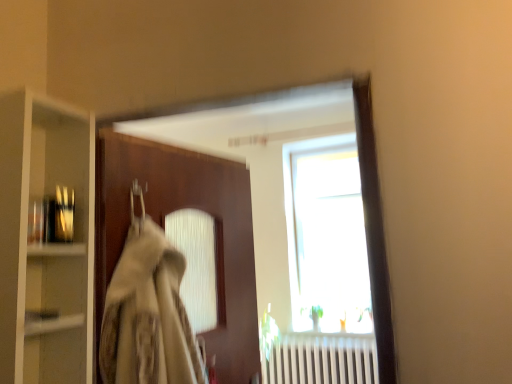
What do you see at coordinates (45, 241) in the screenshot? I see `clear glass cabinet at left` at bounding box center [45, 241].

In order to click on brown wooden door at center in this screenshot , I will do `click(164, 226)`.

Locate an element on the screen. The image size is (512, 384). clear glass cabinet at left is located at coordinates (45, 241).

Considering the sizes of objects brown wooden door at center and metallic glass bottles at left in the image provided, who is shorter, brown wooden door at center or metallic glass bottles at left?

Standing shorter between the two is metallic glass bottles at left.

Is brown wooden door at center far from metallic glass bottles at left?

No.

Is metallic glass bottles at left at the back of brown wooden door at center?

That's not correct — brown wooden door at center is not looking away from metallic glass bottles at left.

From the image's perspective, does brown wooden door at center appear higher than clear glass cabinet at left?

No.

Is brown wooden door at center thinner than clear glass cabinet at left?

Correct, the width of brown wooden door at center is less than that of clear glass cabinet at left.

Would you say brown wooden door at center is a long distance from clear glass cabinet at left?

No, brown wooden door at center is not far away from clear glass cabinet at left.

How many degrees apart are the facing directions of brown wooden door at center and clear glass cabinet at left?

There is a 24.8-degree angle between the facing directions of brown wooden door at center and clear glass cabinet at left.

From the image's perspective, which one is positioned lower, clear glass cabinet at left or brown wooden door at center?

brown wooden door at center is shown below in the image.

Are clear glass cabinet at left and brown wooden door at center making contact?

No, clear glass cabinet at left is not beside brown wooden door at center.

Considering the sizes of clear glass cabinet at left and brown wooden door at center in the image, is clear glass cabinet at left wider or thinner than brown wooden door at center?

Clearly, clear glass cabinet at left has more width compared to brown wooden door at center.

Is brown wooden door at center surrounded by clear glass cabinet at left?

Actually, brown wooden door at center is outside clear glass cabinet at left.

Based on the photo, from the image's perspective, is clear glass cabinet at left positioned above or below metallic glass bottles at left?

clear glass cabinet at left is situated lower than metallic glass bottles at left in the image.

Consider the image. What's the angular difference between clear glass cabinet at left and metallic glass bottles at left's facing directions?

7.95 degrees.

Can you confirm if clear glass cabinet at left is positioned to the right of metallic glass bottles at left?

No, clear glass cabinet at left is not to the right of metallic glass bottles at left.

The image size is (512, 384). Identify the location of shelf above the clear glass cabinet at left (from a real-world perspective). (54, 225).

Is metallic glass bottles at left spatially inside clear glass cabinet at left, or outside of it?

The correct answer is: inside.

Which is more to the left, metallic glass bottles at left or clear glass cabinet at left?

clear glass cabinet at left is more to the left.

Is point (57, 215) closer or farther from the camera than point (39, 221)?

Point (57, 215).

In the image, there is a clear glass cabinet at left. Find the location of `shelf above it (from the image's perspective)`. shelf above it (from the image's perspective) is located at coordinates (54, 225).

Is metallic glass bottles at left spatially inside brown wooden door at center, or outside of it?

The correct answer is: outside.

Who is more distant, metallic glass bottles at left or brown wooden door at center?

Positioned behind is brown wooden door at center.

Is metallic glass bottles at left placed right next to brown wooden door at center?

No, metallic glass bottles at left is not with brown wooden door at center.

From a real-world perspective, which is physically above, metallic glass bottles at left or brown wooden door at center?

From a 3D spatial view, metallic glass bottles at left is above.

This screenshot has width=512, height=384. What are the coordinates of `door behind the metallic glass bottles at left` in the screenshot? It's located at (164, 226).

You are a GUI agent. You are given a task and a screenshot of the screen. Output one action in this format:
    pyautogui.click(x=<x>, y=<y>)
    Task: Click on the cabinetry that is on the left side of brown wooden door at center
    The image size is (512, 384).
    Given the screenshot: What is the action you would take?
    pyautogui.click(x=45, y=241)

Estimate the real-world distances between objects in this image. Which object is further from clear glass cabinet at left, brown wooden door at center or metallic glass bottles at left?

brown wooden door at center is positioned further to the anchor clear glass cabinet at left.

Estimate the real-world distances between objects in this image. Which object is closer to brown wooden door at center, metallic glass bottles at left or clear glass cabinet at left?

clear glass cabinet at left lies closer to brown wooden door at center than the other object.

Looking at this image, based on their spatial positions, is clear glass cabinet at left or brown wooden door at center further from metallic glass bottles at left?

The object further to metallic glass bottles at left is brown wooden door at center.

Which object lies nearer to the anchor point brown wooden door at center, clear glass cabinet at left or metallic glass bottles at left?

clear glass cabinet at left is closer to brown wooden door at center.

Considering their positions, is metallic glass bottles at left positioned further to clear glass cabinet at left than brown wooden door at center?

brown wooden door at center is positioned further to the anchor clear glass cabinet at left.

Based on the photo, from the image, which object appears to be nearer to metallic glass bottles at left, brown wooden door at center or clear glass cabinet at left?

clear glass cabinet at left lies closer to metallic glass bottles at left than the other object.

This screenshot has width=512, height=384. I want to click on shelf between clear glass cabinet at left and brown wooden door at center from left to right, so click(54, 225).